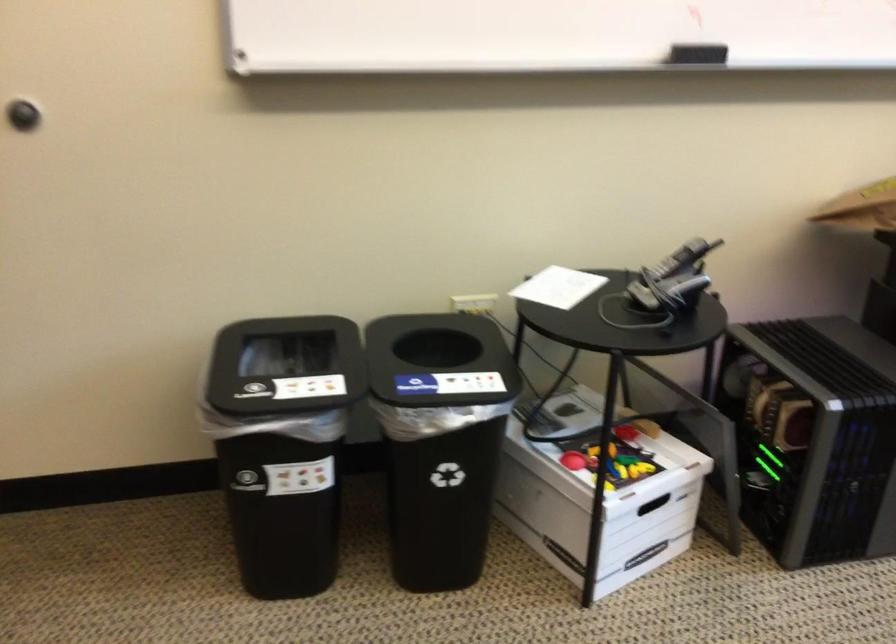
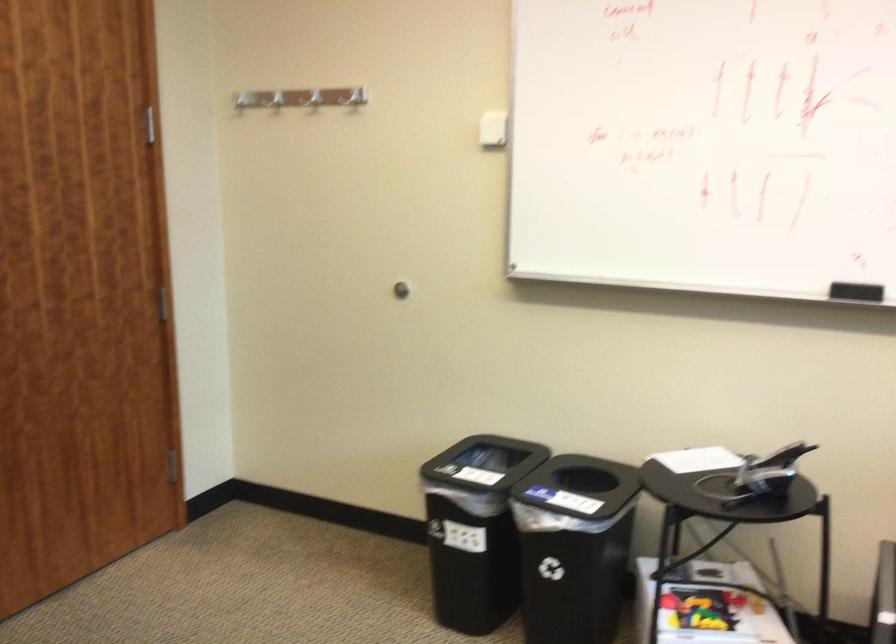
Where in the second image is the point corresponding to the point at 687,261 from the first image?

(782, 456)